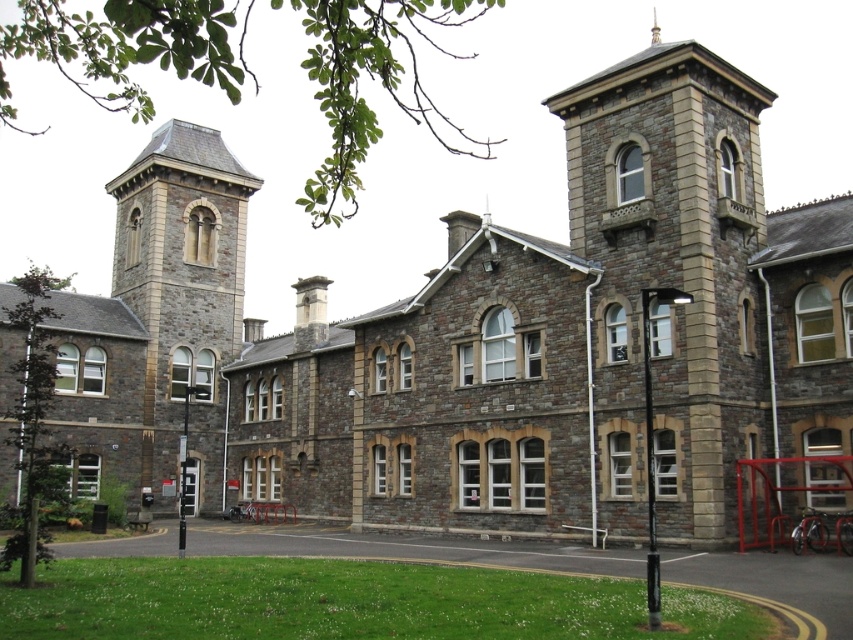
You are standing at point (x=670, y=275) in the image of the historic stone building. What architectural feature can you see directly in front of you?

The stone tower at center is located at point (x=670, y=275), so you can see the stone tower at center directly in front of you.

You are standing in front of the historic stone building and notice two towers. One is the stone tower at center and the other is the gray stone tower at left. Which of these two towers is positioned higher up in the image?

The stone tower at center is positioned higher up in the image than the gray stone tower at left according to the description.